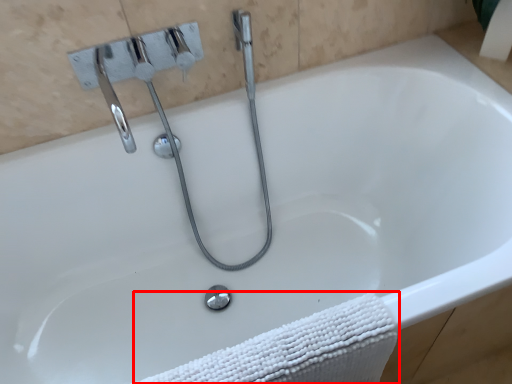
Question: From the image, what is the correct spatial relationship of bath towel (annotated by the red box) in relation to plumbing fixture?

Choices:
 (A) left
 (B) right

Answer: (B)